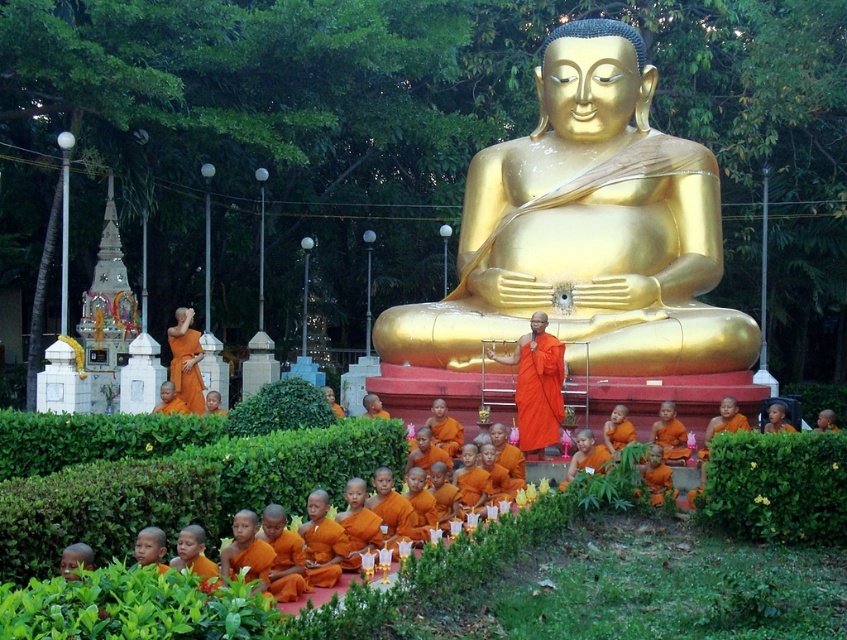
Is point (828, 486) less distant than point (248, 426)?

Yes, point (828, 486) is closer to viewer.

Does point (765, 518) lie behind point (283, 397)?

No, it is in front of (283, 397).

Is point (746, 449) in front of point (268, 396)?

Yes, it is in front of point (268, 396).

Locate an element on the screen. green leafy hedge at lower right is located at coordinates (776, 486).

Which is more to the left, gold polished statue at center or green leafy hedge at lower right?

gold polished statue at center

Is point (621, 99) closer to camera compared to point (796, 488)?

No, (621, 99) is behind (796, 488).

Does point (629, 150) lie in front of point (803, 512)?

No, (629, 150) is further to viewer.

Identify the location of gold polished statue at center. (585, 228).

Is point (558, 404) more distant than point (192, 365)?

No, it is not.

Between orange cloth monk at center and matte orange robe at lower left, which one has less height?

Standing shorter between the two is orange cloth monk at center.

This screenshot has width=847, height=640. I want to click on orange cloth monk at center, so click(535, 385).